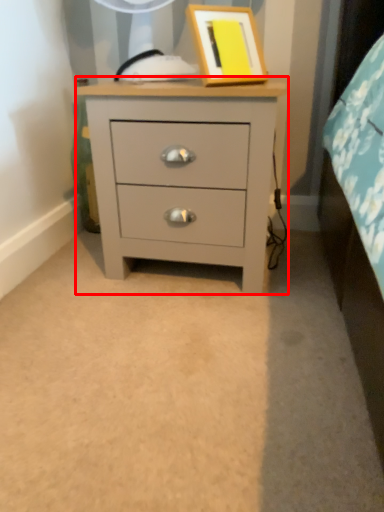
Question: From the image's perspective, what is the correct spatial relationship of chest of drawers (annotated by the red box) in relation to picture frame?

Choices:
 (A) below
 (B) above

Answer: (A)